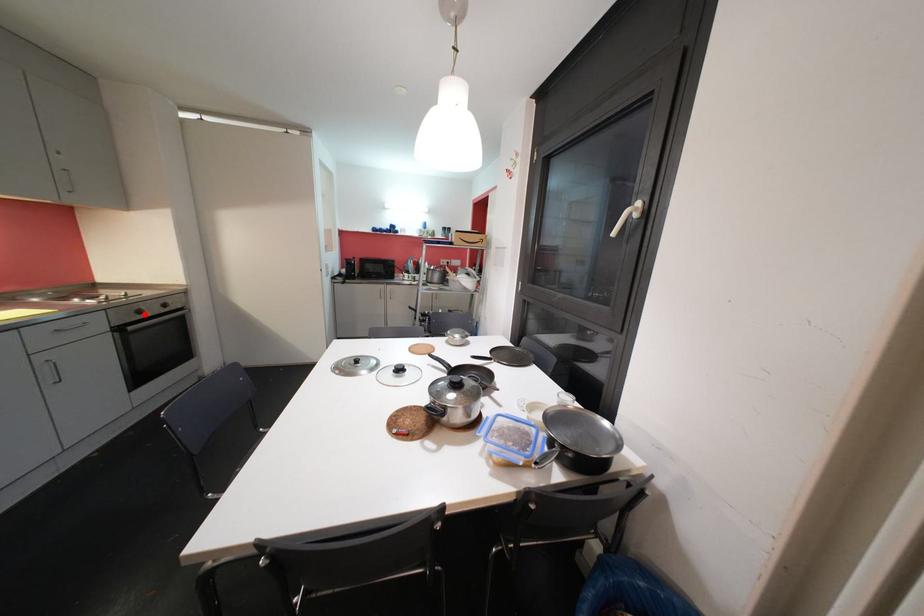
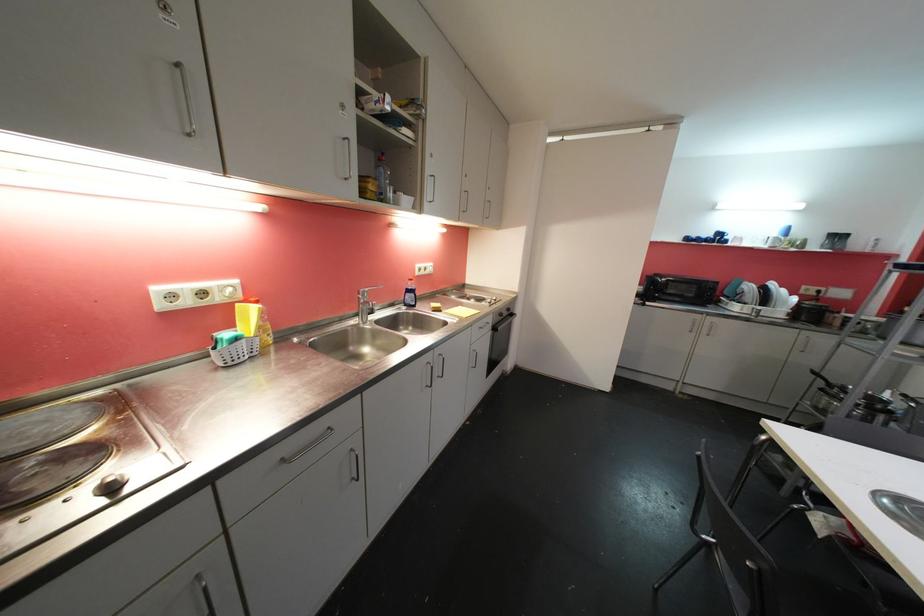
Find the pixel in the second image that matches the highlighted location in the first image.

(505, 317)